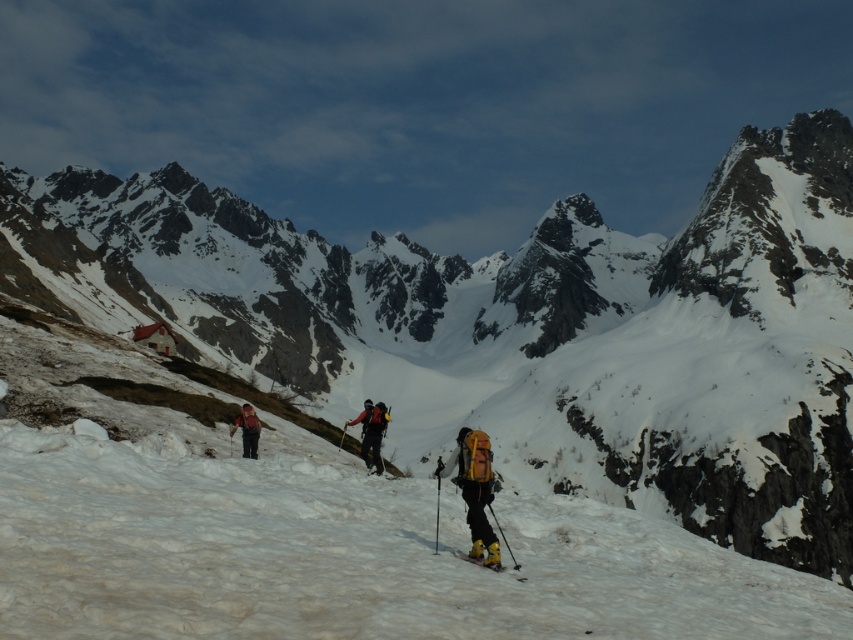
Which is above, yellow fabric backpack at center or matte black backpack at center?

matte black backpack at center is higher up.

Is yellow fabric backpack at center bigger than matte black backpack at center?

Incorrect, yellow fabric backpack at center is not larger than matte black backpack at center.

Does point (485, 468) come in front of point (372, 436)?

That is True.

At what (x,y) coordinates should I click in order to perform the action: click on yellow fabric backpack at center. Please return your answer as a coordinate pair (x, y). The width and height of the screenshot is (853, 640). Looking at the image, I should click on (474, 490).

Based on the photo, does matte red backpack at center appear over yellow matte ski at lower center?

Yes, matte red backpack at center is above yellow matte ski at lower center.

Which is behind, point (244, 456) or point (523, 576)?

Point (244, 456)

The width and height of the screenshot is (853, 640). I want to click on matte red backpack at center, so click(x=247, y=429).

From the picture: Does yellow fabric backpack at center have a lesser width compared to matte red backpack at center?

Yes.

Can you confirm if yellow fabric backpack at center is shorter than matte red backpack at center?

No, yellow fabric backpack at center is not shorter than matte red backpack at center.

Locate an element on the screen. The image size is (853, 640). yellow fabric backpack at center is located at coordinates (474, 490).